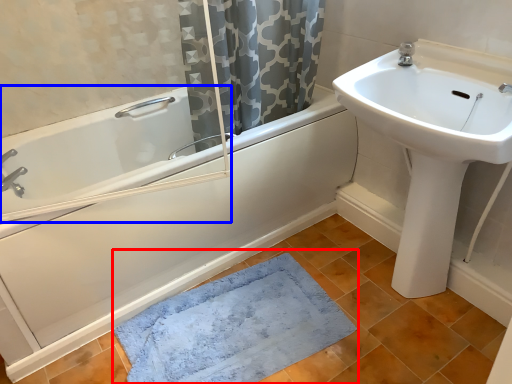
Question: Which point is further to the camera, bath mat (highlighted by a red box) or bath (highlighted by a blue box)?

Choices:
 (A) bath mat
 (B) bath

Answer: (A)